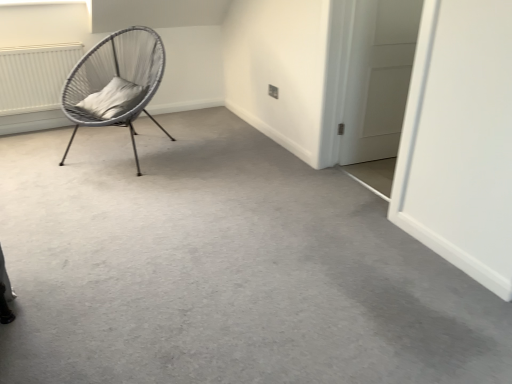
Image resolution: width=512 pixels, height=384 pixels. I want to click on vacant region to the right of woven grey chair at left, so coord(215,150).